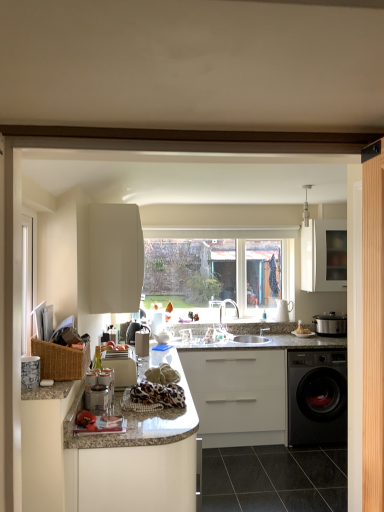
Question: Is matte silver slow cooker at right, the 2th appliance positioned from the left, located outside light wood barn door at right?

Choices:
 (A) yes
 (B) no

Answer: (A)

Question: Are matte silver slow cooker at right, acting as the first appliance starting from the right, and light wood barn door at right making contact?

Choices:
 (A) yes
 (B) no

Answer: (B)

Question: Is matte silver slow cooker at right, acting as the 1th appliance starting from the back, at the left side of light wood barn door at right?

Choices:
 (A) yes
 (B) no

Answer: (B)

Question: Is light wood barn door at right inside matte silver slow cooker at right, the 2th appliance positioned from the left?

Choices:
 (A) yes
 (B) no

Answer: (B)

Question: From a real-world perspective, is matte silver slow cooker at right, arranged as the second appliance when viewed from the front, physically below light wood barn door at right?

Choices:
 (A) yes
 (B) no

Answer: (A)

Question: From a real-world perspective, is matte silver slow cooker at right, acting as the first appliance starting from the right, over light wood barn door at right?

Choices:
 (A) no
 (B) yes

Answer: (A)

Question: Can you see black glossy tile at lower center touching woven brown basket at left?

Choices:
 (A) yes
 (B) no

Answer: (B)

Question: Considering the relative sizes of black glossy tile at lower center and woven brown basket at left in the image provided, is black glossy tile at lower center shorter than woven brown basket at left?

Choices:
 (A) no
 (B) yes

Answer: (B)

Question: From a real-world perspective, does black glossy tile at lower center stand above woven brown basket at left?

Choices:
 (A) no
 (B) yes

Answer: (A)

Question: From the image's perspective, would you say black glossy tile at lower center is shown under woven brown basket at left?

Choices:
 (A) yes
 (B) no

Answer: (A)

Question: Does black glossy tile at lower center turn towards woven brown basket at left?

Choices:
 (A) no
 (B) yes

Answer: (A)

Question: Does black glossy tile at lower center have a smaller size compared to woven brown basket at left?

Choices:
 (A) yes
 (B) no

Answer: (B)

Question: Is woven brown basket at left completely or partially outside of white matte cabinet at upper center, the 4th cabinetry viewed from the right?

Choices:
 (A) yes
 (B) no

Answer: (A)